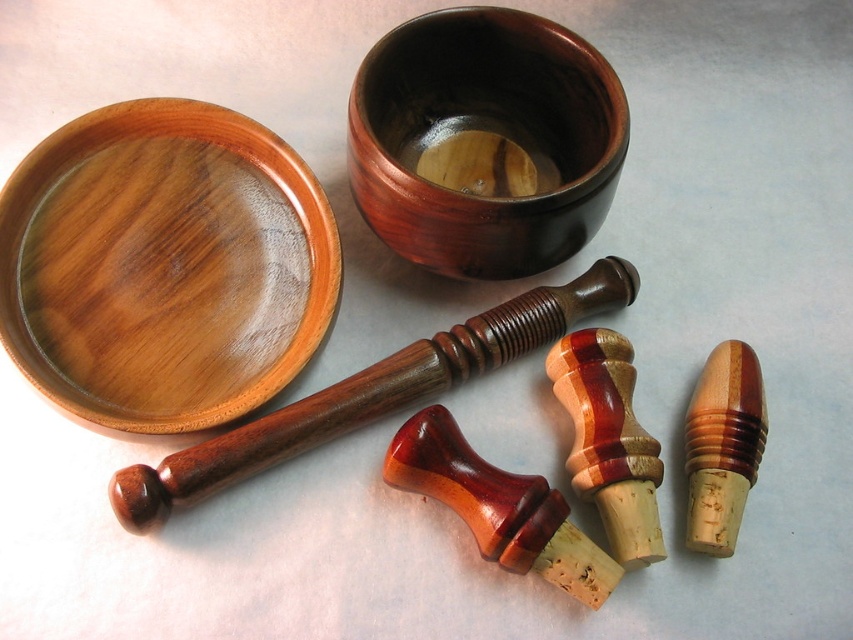
Is wooden bowl at upper left below dark wood bowl at center?

Yes.

Can you confirm if wooden bowl at upper left is positioned to the right of dark wood bowl at center?

In fact, wooden bowl at upper left is to the left of dark wood bowl at center.

Who is more forward, (0, 205) or (492, 104)?

Point (0, 205)

Identify the location of wooden bowl at upper left. (164, 266).